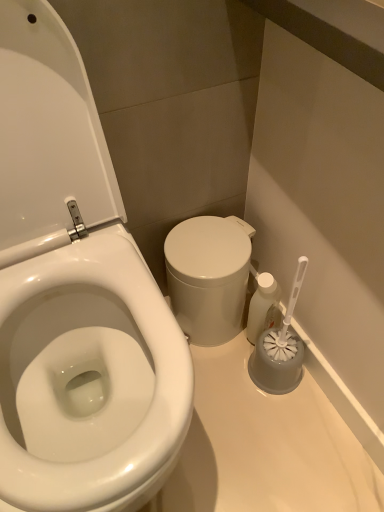
What is the approximate width of white plastic toilet brush at lower right?

It is 2.77 inches.

Where is `white plastic toilet brush at lower right`? white plastic toilet brush at lower right is located at coordinates (263, 307).

What do you see at coordinates (263, 307) in the screenshot? I see `white plastic toilet brush at lower right` at bounding box center [263, 307].

The width and height of the screenshot is (384, 512). Identify the location of white plastic toilet brush at lower right. (263, 307).